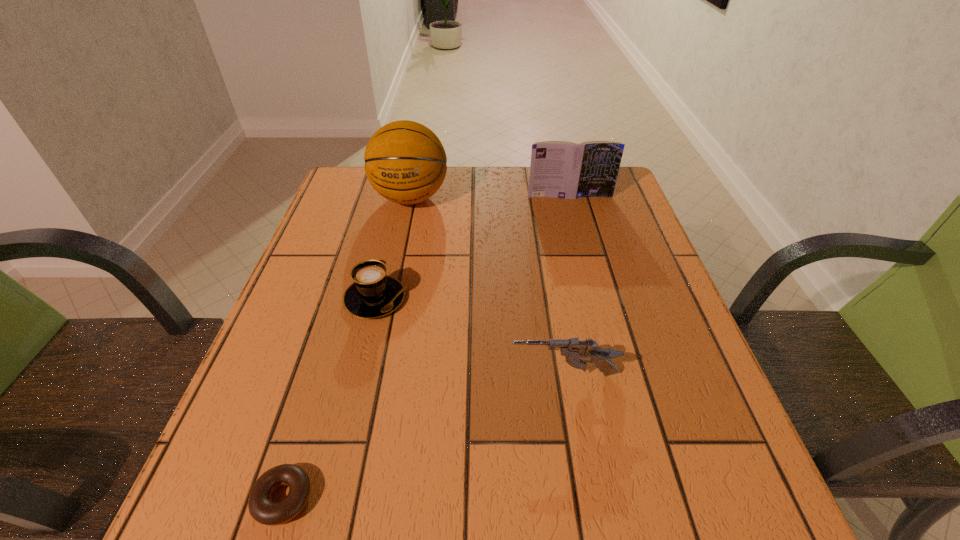
Where is `vacant space located 0.350m at the barrel of the second nearest object`? The width and height of the screenshot is (960, 540). vacant space located 0.350m at the barrel of the second nearest object is located at coordinates (316, 375).

This screenshot has width=960, height=540. What are the coordinates of `free space located at the barrel of the second nearest object` in the screenshot? It's located at (344, 375).

Identify the location of vacant position located at the barrel of the second nearest object. (311, 375).

Where is `free space located 0.120m on the left of the fourth tallest object`? This screenshot has width=960, height=540. free space located 0.120m on the left of the fourth tallest object is located at coordinates (288, 299).

Locate an element on the screen. The height and width of the screenshot is (540, 960). free space located 0.280m on the right of the nearest object is located at coordinates (505, 498).

The image size is (960, 540). Find the location of `basketball at the far edge`. basketball at the far edge is located at coordinates (405, 162).

I want to click on book present at the far edge, so click(x=560, y=169).

This screenshot has width=960, height=540. Identify the location of object situated at the near edge. (261, 507).

This screenshot has height=540, width=960. What are the coordinates of `basketball that is positioned at the left edge` in the screenshot? It's located at (405, 162).

Identify the location of cappuccino that is at the left edge. (373, 294).